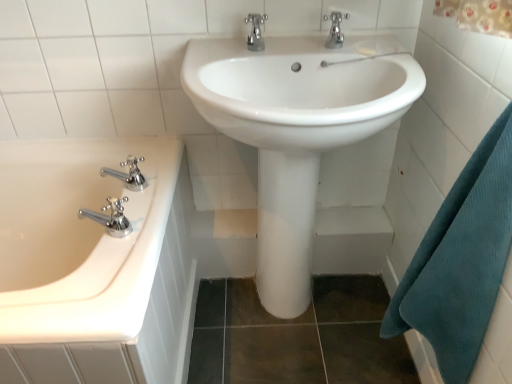
Find the location of a particular element. The width and height of the screenshot is (512, 384). free space to the left of chrome metallic faucet at upper center, arranged as the 2th tap when viewed from the top is located at coordinates (216, 48).